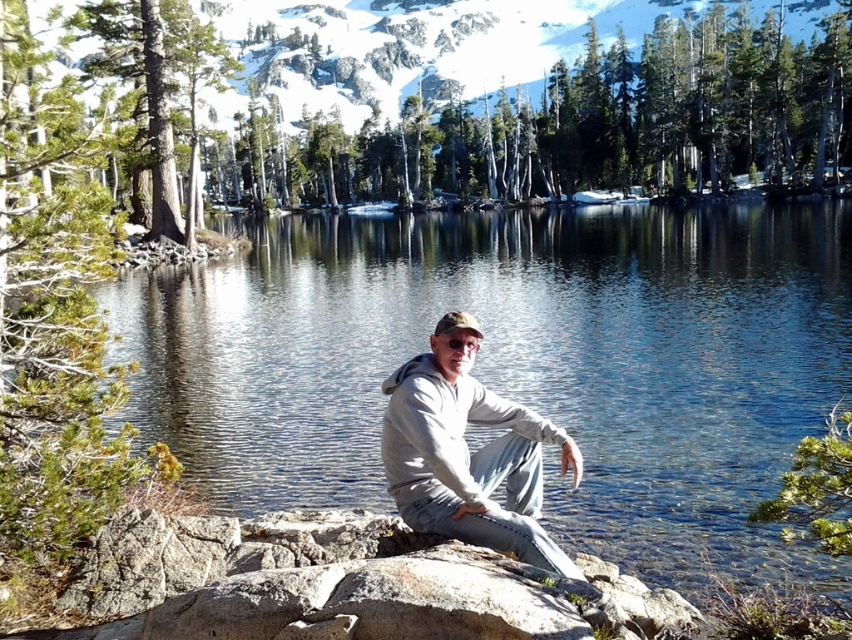
Which of these two, clear water at center or gray matte hoodie at center, stands shorter?

Standing shorter between the two is gray matte hoodie at center.

Find the location of `clear water at center`. clear water at center is located at coordinates (517, 364).